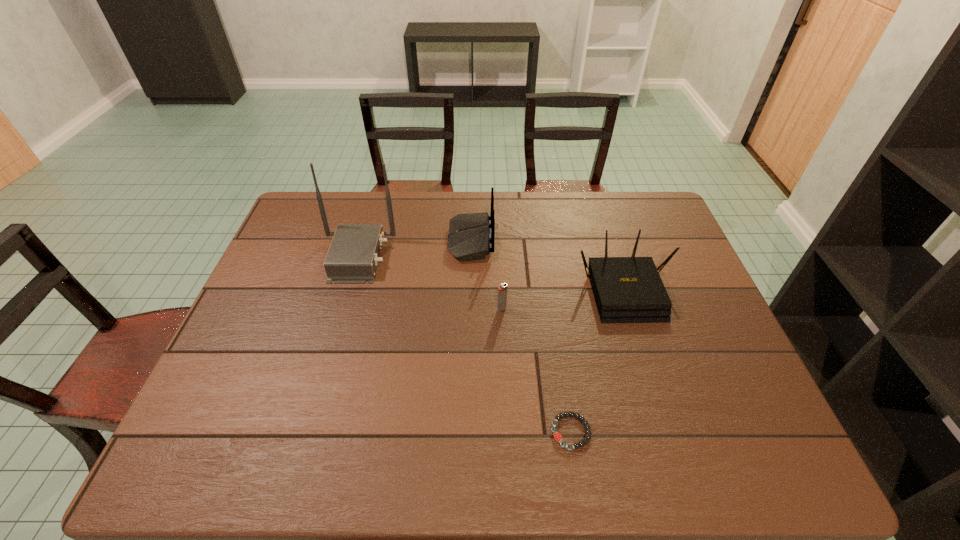
Identify the location of vacant area that satisfies the following two spatial constraints: 1. on the back of the third object from right to left to connect cables; 2. on the left side of the leftmost object. (343, 309).

I want to click on vacant region that satisfies the following two spatial constraints: 1. on the back of the fourth object from right to left; 2. on the right side of the second object from right to left, so [467, 432].

Where is `vacant region that satisfies the following two spatial constraints: 1. on the back of the leftmost object to connect cables; 2. on the right side of the bracelet`? vacant region that satisfies the following two spatial constraints: 1. on the back of the leftmost object to connect cables; 2. on the right side of the bracelet is located at coordinates (306, 432).

Where is `vacant space that satisfies the following two spatial constraints: 1. on the back of the bracelet to connect cables; 2. on the left side of the leftmost router`? This screenshot has width=960, height=540. vacant space that satisfies the following two spatial constraints: 1. on the back of the bracelet to connect cables; 2. on the left side of the leftmost router is located at coordinates coord(306,432).

I want to click on free spot that satisfies the following two spatial constraints: 1. on the back of the tallest object to connect cables; 2. on the back side of the third shortest object, so click(348, 289).

Locate an element on the screen. This screenshot has height=540, width=960. vacant position in the image that satisfies the following two spatial constraints: 1. on the back of the leftmost object to connect cables; 2. on the left side of the third object from right to left is located at coordinates (343, 309).

This screenshot has height=540, width=960. Identify the location of free space that satisfies the following two spatial constraints: 1. on the back of the second shortest router; 2. on the right side of the bracelet. (467, 432).

I want to click on vacant space that satisfies the following two spatial constraints: 1. on the back of the third object from left to right to connect cables; 2. on the right side of the leftmost router, so click(x=343, y=309).